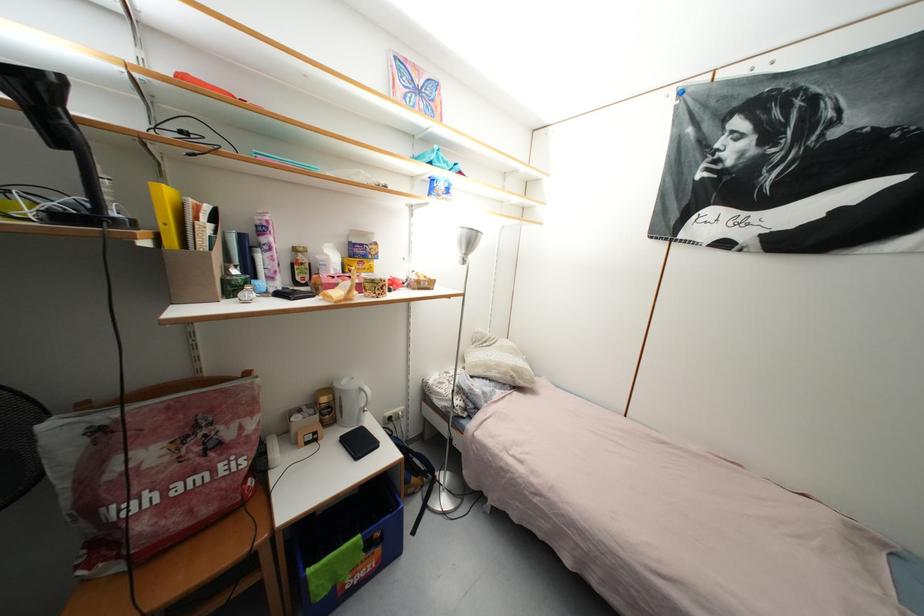
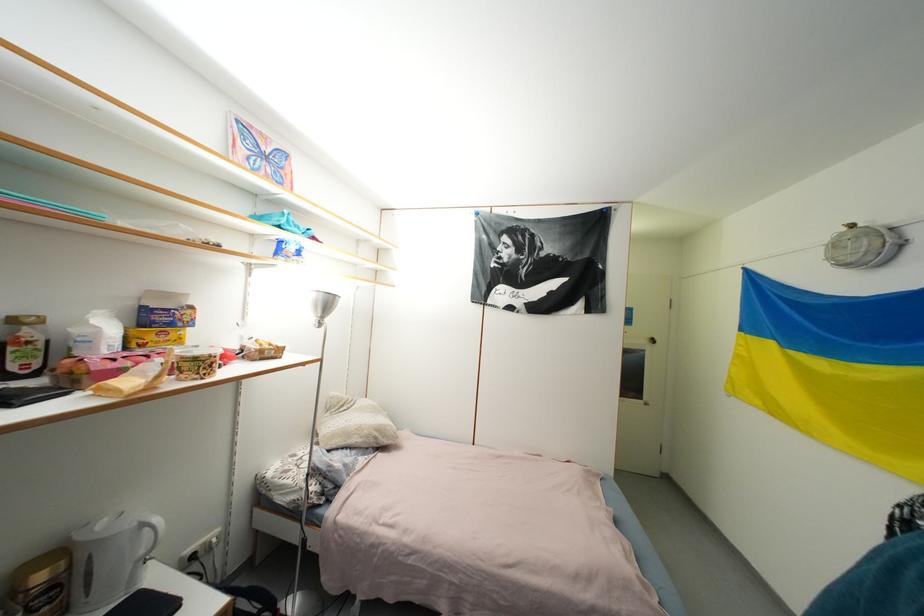
In the second image, find the point that corresponds to point 338,259 in the first image.

(112, 331)